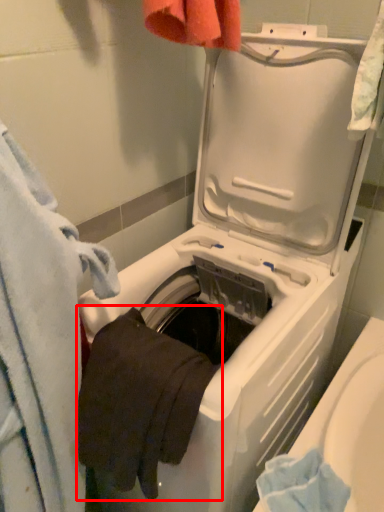
Question: From the image's perspective, what is the correct spatial relationship of bath towel (annotated by the red box) in relation to towel?

Choices:
 (A) below
 (B) above

Answer: (B)